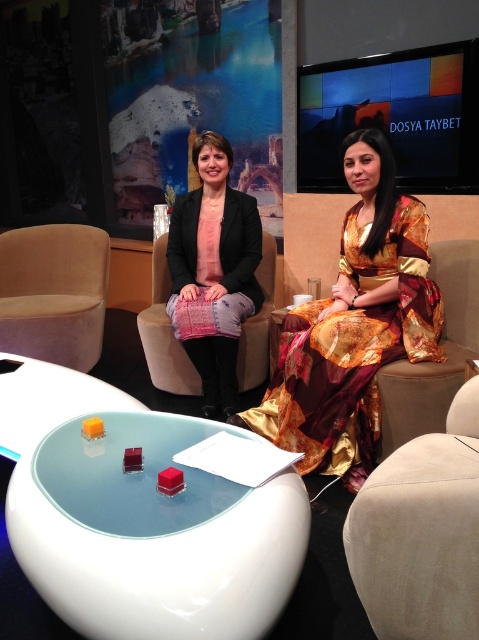
Is beige suede armchair at right positioned behind velvet beige armchair at left?

No, beige suede armchair at right is closer to the viewer.

Is point (378, 618) closer to camera compared to point (92, 241)?

That is True.

The height and width of the screenshot is (640, 479). What are the coordinates of `beige suede armchair at right` in the screenshot? It's located at (421, 532).

Find the location of a particular element. beige suede armchair at right is located at coordinates (421, 532).

Can you confirm if velvet beige armchair at left is smaller than black fabric armchair at center?

Actually, velvet beige armchair at left might be larger than black fabric armchair at center.

This screenshot has width=479, height=640. What are the coordinates of `velvet beige armchair at left` in the screenshot? It's located at (54, 292).

Where is `velvet beige armchair at left`? The image size is (479, 640). velvet beige armchair at left is located at coordinates (54, 292).

Who is shorter, velvet armchair at center or black fabric armchair at center?

Standing shorter between the two is velvet armchair at center.

Is velvet armchair at center wider than black fabric armchair at center?

Yes, velvet armchair at center is wider than black fabric armchair at center.

Describe the element at coordinates (433, 362) in the screenshot. The width and height of the screenshot is (479, 640). I see `velvet armchair at center` at that location.

The height and width of the screenshot is (640, 479). Identify the location of velvet armchair at center. (433, 362).